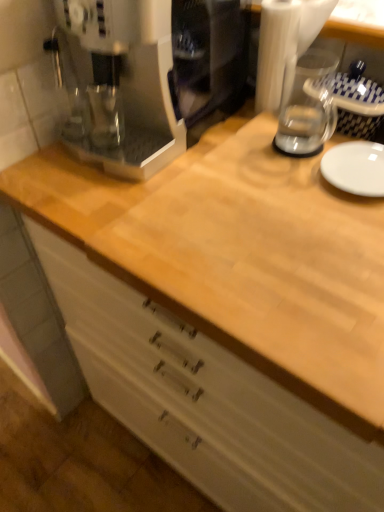
The width and height of the screenshot is (384, 512). Find the location of `free space above natural wood cabinet at center (from a real-world perspective)`. free space above natural wood cabinet at center (from a real-world perspective) is located at coordinates (268, 182).